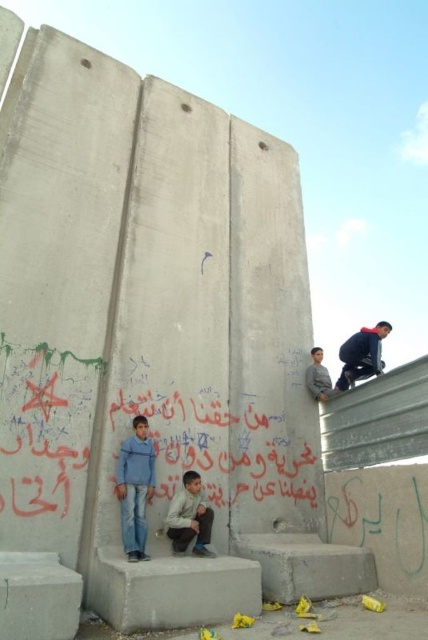
You are a photographer trying to capture the scene of the wall with the two children. To ensure both the blue jeans at lower left and the gray fabric jacket at upper right are in frame, which direction should you move your camera? Explain your reasoning based on their positions.

The blue jeans at lower left is to the left of the gray fabric jacket at upper right. To include both in the frame, you should position the camera to the right side so that the leftward placement of the blue jeans at lower left and the rightward placement of the gray fabric jacket at upper right can both be captured within the camera view.

You are a photographer taking a picture of the scene. You notice the blue jeans at lower left and the gray fabric jacket at upper right in your frame. Which object should you zoom in on to make the smaller one fill the frame better?

The gray fabric jacket at upper right is smaller, so zooming in on it would make it fill the frame better.